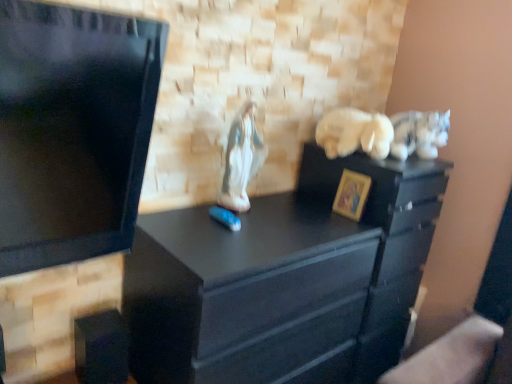
Locate an element on the screen. Image resolution: width=512 pixels, height=384 pixels. vacant space situated on the left part of gold painted wood picture frame at center right is located at coordinates tap(298, 214).